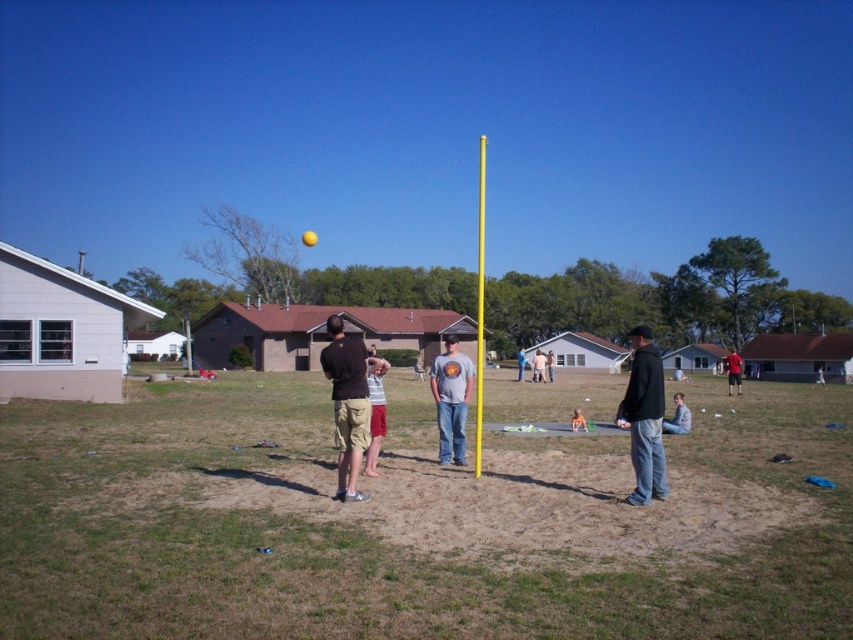
Between point (648, 436) and point (368, 376), which one is positioned in front?

Point (648, 436)

How much distance is there between dark gray hoodie at center and striped cotton shirt at center?

The distance of dark gray hoodie at center from striped cotton shirt at center is 6.59 meters.

Locate an element on the screen. This screenshot has height=640, width=853. dark gray hoodie at center is located at coordinates (643, 419).

Does dark gray hoodie at center have a smaller size compared to gray cotton shirt at center?

Indeed, dark gray hoodie at center has a smaller size compared to gray cotton shirt at center.

Is dark gray hoodie at center below gray cotton shirt at center?

Incorrect, dark gray hoodie at center is not positioned below gray cotton shirt at center.

Who is more distant from viewer, [648,493] or [549,369]?

Positioned behind is point [549,369].

Identify the location of dark gray hoodie at center. (643, 419).

In the scene shown: Is matte gray t-shirt at center wider than gray cotton t-shirt at center?

In fact, matte gray t-shirt at center might be narrower than gray cotton t-shirt at center.

Is point (463, 460) more distant than point (540, 380)?

No.

Does point (448, 376) come behind point (543, 381)?

No, (448, 376) is closer to viewer.

At what (x,y) coordinates should I click in order to perform the action: click on matte gray t-shirt at center. Please return your answer as a coordinate pair (x, y). The image size is (853, 640). Looking at the image, I should click on (451, 400).